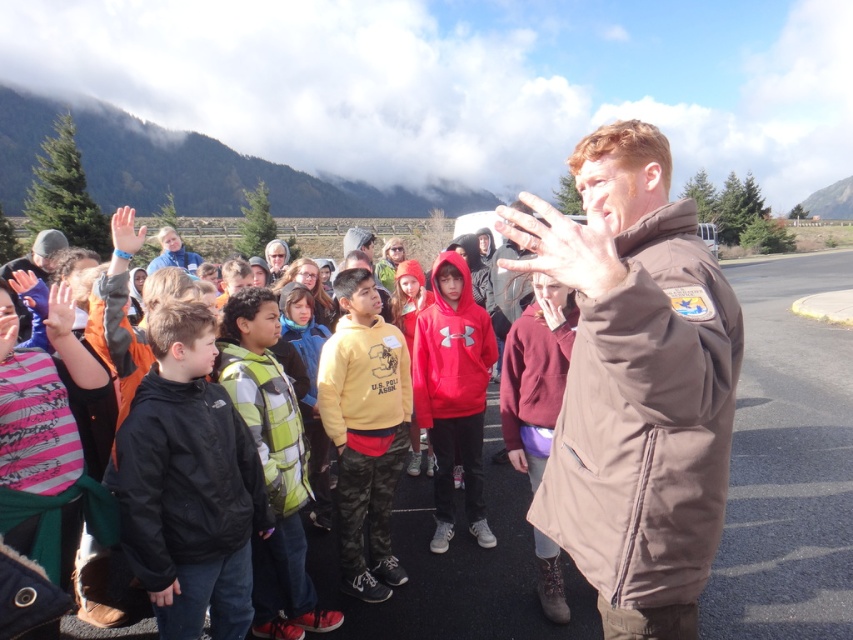
You are a participant in the outdoor session and notice two hands holding a map. The matte orange hand at upper left and the matte black hand at lower left are both pointing at different landmarks on the map. Which hand is closer to the edge of the map?

The matte orange hand at upper left is positioned on the left side of the matte black hand at lower left, so it is closer to the edge of the map.

Where is the red fleece hoodie at center located in the image?

The red fleece hoodie at center is located at point coordinates of 0.614 on the x axis and 0.532 on the y axis.

You are a photographer trying to capture a group photo of the red fleece hoodie at center and the matte orange hand at upper left. If you want to ensure both subjects are in focus, which one should you adjust your camera focus to prioritize based on their sizes?

The red fleece hoodie at center has a lesser width compared to matte orange hand at upper left. Therefore, you should prioritize focusing on the red fleece hoodie at center since it is smaller and requires more precise focus to capture details clearly.